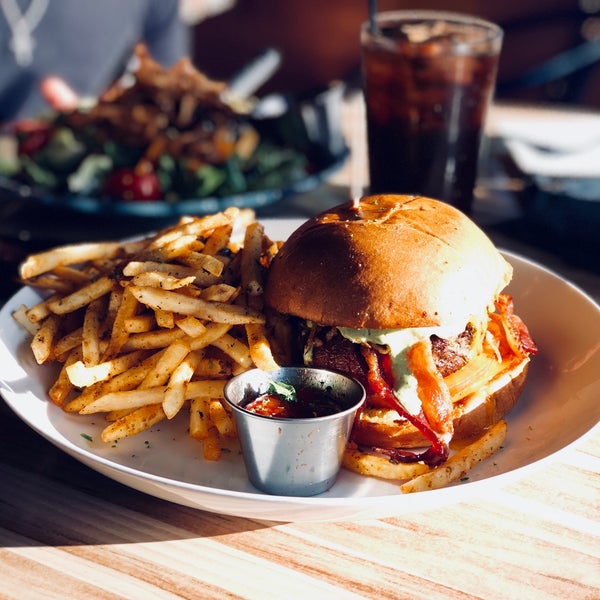
Image resolution: width=600 pixels, height=600 pixels. In order to click on glass in this screenshot , I will do `click(490, 43)`.